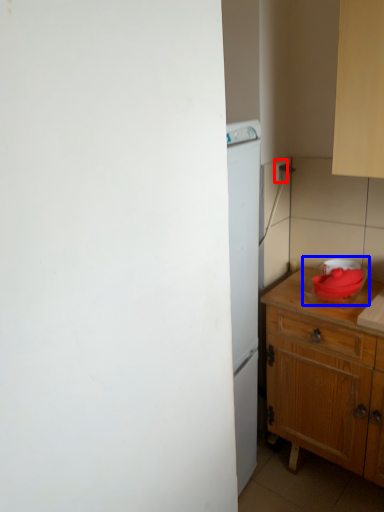
Question: Among these objects, which one is farthest to the camera, electric outlet (highlighted by a red box) or appliance (highlighted by a blue box)?

Choices:
 (A) electric outlet
 (B) appliance

Answer: (A)